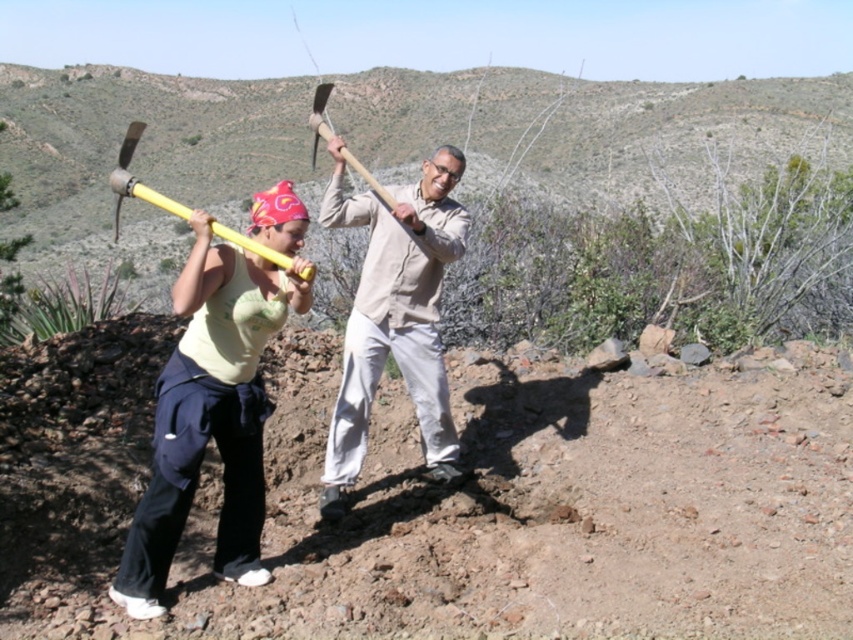
You are a worker in the arid landscape and need to choose a tool with a wider head between the yellow plastic pickaxe at center and the yellow plastic ax at upper center. Which one should you pick?

The yellow plastic ax at upper center has a wider head than the yellow plastic pickaxe at center, so you should choose the yellow plastic ax at upper center.

You are a worker in the scene and need to reach both the yellow plastic ax at upper center and the wooden handle axe at center. Which one is closer to your current position?

The yellow plastic ax at upper center is to the left of the wooden handle axe at center, but without knowing your exact position, it is impossible to determine which is closer. Please provide more information about your location.